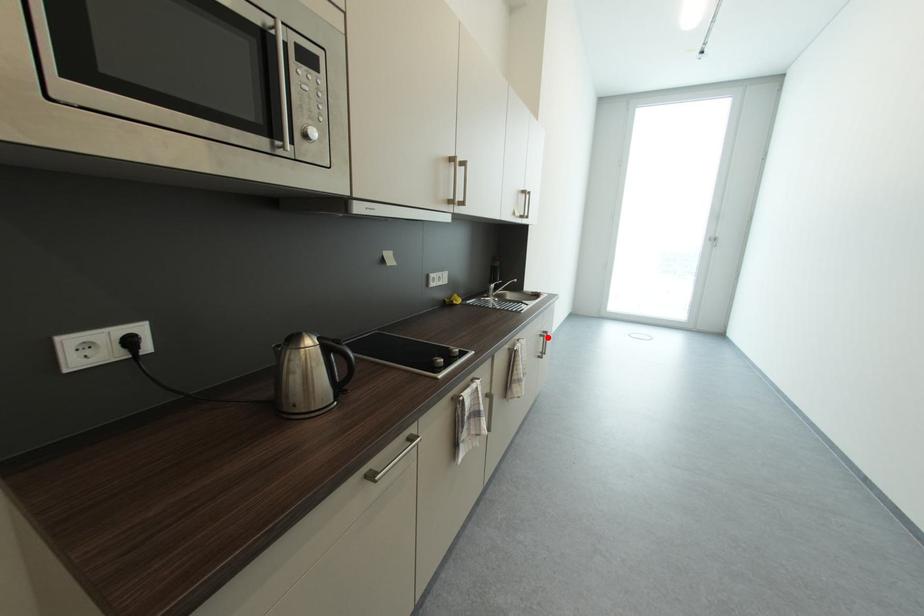
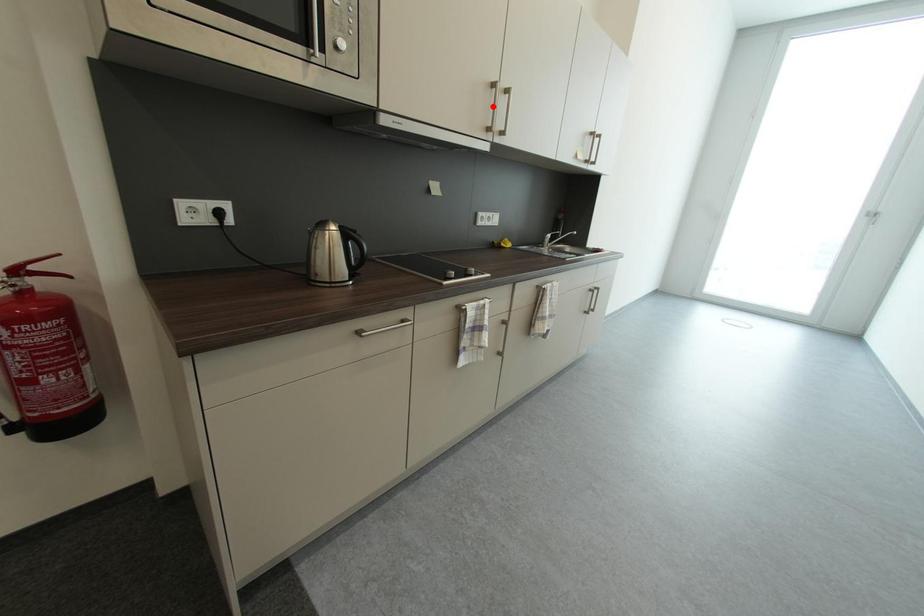
In the scene shown: I am providing you with two images of the same scene from different viewpoints. A red point is marked on the first image and another point is marked on the second image. Is the red point in image1 aligned with the point shown in image2?

No